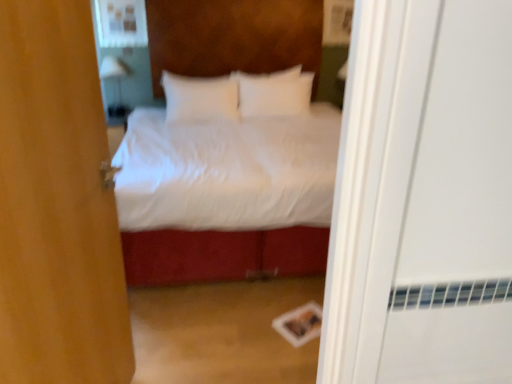
Image resolution: width=512 pixels, height=384 pixels. Find the location of `matte white medicine cabinet at upper left`. matte white medicine cabinet at upper left is located at coordinates (121, 23).

Describe the element at coordinates (275, 93) in the screenshot. I see `white soft pillow at center, positioned as the second pillow in left-to-right order` at that location.

This screenshot has height=384, width=512. In order to click on white glossy lamp at upper left in this screenshot , I will do `click(115, 84)`.

At what (x,y) coordinates should I click in order to perform the action: click on matte white medicine cabinet at upper left. Please return your answer as a coordinate pair (x, y). Looking at the image, I should click on (121, 23).

Is the depth of brown fabric door at center greater than that of white soft pillow at center, positioned as the second pillow in left-to-right order?

No, brown fabric door at center is in front of white soft pillow at center, positioned as the second pillow in left-to-right order.

Is brown fabric door at center situated inside white soft pillow at center, positioned as the second pillow in left-to-right order, or outside?

brown fabric door at center is located beyond the bounds of white soft pillow at center, positioned as the second pillow in left-to-right order.

Which is more to the right, brown fabric door at center or white soft pillow at center, positioned as the second pillow in left-to-right order?

white soft pillow at center, positioned as the second pillow in left-to-right order.

Is white soft pillow at center, positioned as the second pillow in left-to-right order, in front of or behind matte white medicine cabinet at upper left in the image?

white soft pillow at center, positioned as the second pillow in left-to-right order, is in front of matte white medicine cabinet at upper left.

Is white soft pillow at center, positioned as the second pillow in left-to-right order, spatially inside matte white medicine cabinet at upper left, or outside of it?

white soft pillow at center, positioned as the second pillow in left-to-right order, is spatially situated outside matte white medicine cabinet at upper left.

From the image's perspective, between white soft pillow at center, positioned as the second pillow in left-to-right order, and matte white medicine cabinet at upper left, who is located below?

white soft pillow at center, positioned as the second pillow in left-to-right order, appears lower in the image.

Which is more to the right, white soft pillow at center, positioned as the second pillow in left-to-right order, or matte white medicine cabinet at upper left?

From the viewer's perspective, white soft pillow at center, positioned as the second pillow in left-to-right order, appears more on the right side.

Considering the sizes of objects brown fabric door at center and white soft bed at center in the image provided, who is smaller, brown fabric door at center or white soft bed at center?

Smaller between the two is brown fabric door at center.

Based on the photo, could you tell me if brown fabric door at center is facing white soft bed at center?

No, brown fabric door at center is not turned towards white soft bed at center.

Would you consider brown fabric door at center to be distant from white soft bed at center?

That's right, there is a large distance between brown fabric door at center and white soft bed at center.

The height and width of the screenshot is (384, 512). What are the coordinates of `bed lying on the right of brown fabric door at center` in the screenshot? It's located at (233, 37).

From a real-world perspective, is matte white medicine cabinet at upper left above or below white soft pillow at center, positioned as the second pillow in left-to-right order?

In terms of real-world spatial position, matte white medicine cabinet at upper left is above white soft pillow at center, positioned as the second pillow in left-to-right order.

Do you think matte white medicine cabinet at upper left is within white soft pillow at center, the first pillow viewed from the right, or outside of it?

matte white medicine cabinet at upper left is spatially situated outside white soft pillow at center, the first pillow viewed from the right.

Based on the photo, is matte white medicine cabinet at upper left oriented away from white soft pillow at center, positioned as the second pillow in left-to-right order?

matte white medicine cabinet at upper left does not have its back to white soft pillow at center, positioned as the second pillow in left-to-right order.

Is the surface of white soft bed at center in direct contact with matte white medicine cabinet at upper left?

No.

Considering the sizes of objects white soft bed at center and matte white medicine cabinet at upper left in the image provided, who is shorter, white soft bed at center or matte white medicine cabinet at upper left?

matte white medicine cabinet at upper left is shorter.

Consider the image. In terms of width, does white soft bed at center look wider or thinner when compared to matte white medicine cabinet at upper left?

white soft bed at center is wider than matte white medicine cabinet at upper left.

Which of these two, white soft bed at center or matte white medicine cabinet at upper left, is bigger?

With larger size is white soft bed at center.

Which is in front, point (317, 44) or point (244, 89)?

The point (244, 89) is in front.

Find the location of a particular element. pillow that is the 2nd one when counting upward from the white soft bed at center (from the image's perspective) is located at coordinates (275, 93).

Are white soft bed at center and white soft pillow at center, positioned as the second pillow in left-to-right order, located far from each other?

No, there isn't a large distance between white soft bed at center and white soft pillow at center, positioned as the second pillow in left-to-right order.

Considering the sizes of objects white soft bed at center and white soft pillow at center, positioned as the second pillow in left-to-right order, in the image provided, who is wider, white soft bed at center or white soft pillow at center, positioned as the second pillow in left-to-right order,?

With larger width is white soft bed at center.

Considering the sizes of objects white glossy lamp at upper left and white soft pillow at center, the first pillow when ordered from left to right, in the image provided, who is shorter, white glossy lamp at upper left or white soft pillow at center, the first pillow when ordered from left to right,?

white glossy lamp at upper left.

Is the surface of white glossy lamp at upper left in direct contact with white soft pillow at center, acting as the second pillow starting from the right?

There is a gap between white glossy lamp at upper left and white soft pillow at center, acting as the second pillow starting from the right.

This screenshot has width=512, height=384. I want to click on lamp located behind the white soft pillow at center, acting as the second pillow starting from the right, so click(x=115, y=84).

Find the location of a particular element. The height and width of the screenshot is (384, 512). the 2nd pillow behind the brown fabric door at center is located at coordinates (275, 93).

Find the location of a particular element. The image size is (512, 384). the 1st pillow directly beneath the matte white medicine cabinet at upper left (from a real-world perspective) is located at coordinates (275, 93).

Considering their positions, is white soft pillow at center, the first pillow when ordered from left to right, positioned further to white glossy lamp at upper left than white soft pillow at center, positioned as the second pillow in left-to-right order?

white soft pillow at center, positioned as the second pillow in left-to-right order.

Looking at the image, which one is located further to white soft pillow at center, positioned as the second pillow in left-to-right order, white soft bed at center or brown fabric door at center?

The object further to white soft pillow at center, positioned as the second pillow in left-to-right order, is brown fabric door at center.

From the image, which object appears to be nearer to white soft pillow at center, positioned as the second pillow in left-to-right order, white soft pillow at center, the first pillow when ordered from left to right, or white glossy lamp at upper left?

white soft pillow at center, the first pillow when ordered from left to right, lies closer to white soft pillow at center, positioned as the second pillow in left-to-right order, than the other object.

When comparing their distances from white soft pillow at center, the first pillow when ordered from left to right, does matte white medicine cabinet at upper left or white soft pillow at center, positioned as the second pillow in left-to-right order, seem closer?

Based on the image, white soft pillow at center, positioned as the second pillow in left-to-right order, appears to be nearer to white soft pillow at center, the first pillow when ordered from left to right.

Which object lies further to the anchor point white soft bed at center, matte white medicine cabinet at upper left or white soft pillow at center, acting as the second pillow starting from the right?

The object further to white soft bed at center is white soft pillow at center, acting as the second pillow starting from the right.

Estimate the real-world distances between objects in this image. Which object is closer to matte white medicine cabinet at upper left, white soft pillow at center, the first pillow viewed from the right, or brown fabric door at center?

Based on the image, white soft pillow at center, the first pillow viewed from the right, appears to be nearer to matte white medicine cabinet at upper left.

Looking at the image, which one is located closer to matte white medicine cabinet at upper left, white soft pillow at center, positioned as the second pillow in left-to-right order, or white soft pillow at center, the first pillow when ordered from left to right?

Based on the image, white soft pillow at center, the first pillow when ordered from left to right, appears to be nearer to matte white medicine cabinet at upper left.

Which object lies nearer to the anchor point white soft bed at center, matte white medicine cabinet at upper left or white soft pillow at center, the first pillow viewed from the right?

The object closer to white soft bed at center is matte white medicine cabinet at upper left.

You are a GUI agent. You are given a task and a screenshot of the screen. Output one action in this format:
    pyautogui.click(x=<x>, y=<y>)
    Task: Click on the bed positioned between brown fabric door at center and white soft pillow at center, positioned as the second pillow in left-to-right order, from near to far
    This screenshot has height=384, width=512.
    Given the screenshot: What is the action you would take?
    pyautogui.click(x=233, y=37)

The height and width of the screenshot is (384, 512). Identify the location of medicine cabinet between white soft bed at center and white glossy lamp at upper left in the front-back direction. (121, 23).

Locate an element on the screen. This screenshot has width=512, height=384. pillow between white glossy lamp at upper left and white soft pillow at center, the first pillow viewed from the right, in the horizontal direction is located at coordinates coord(200,97).

At what (x,y) coordinates should I click in order to perform the action: click on medicine cabinet situated between white glossy lamp at upper left and white soft pillow at center, positioned as the second pillow in left-to-right order, from left to right. Please return your answer as a coordinate pair (x, y). The image size is (512, 384). Looking at the image, I should click on (121, 23).